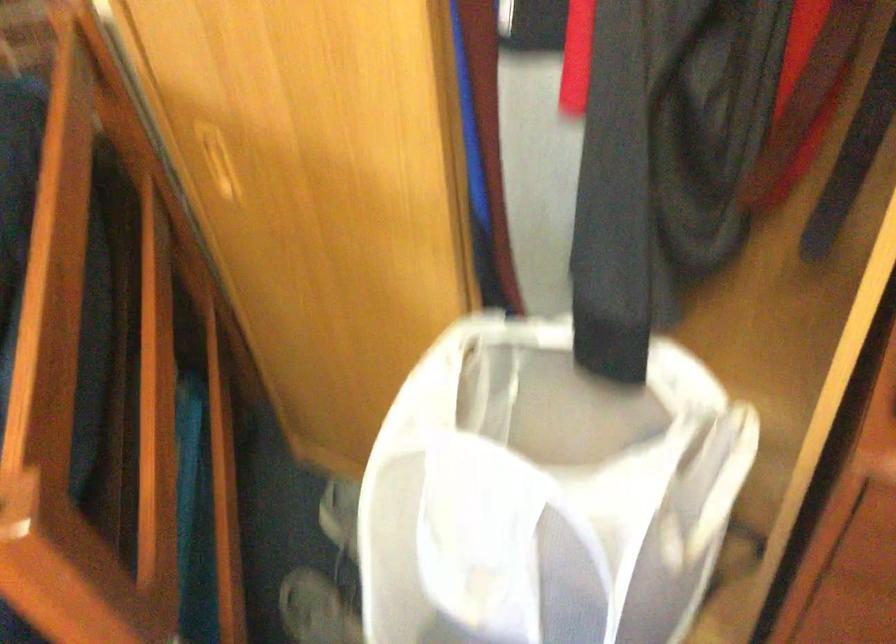
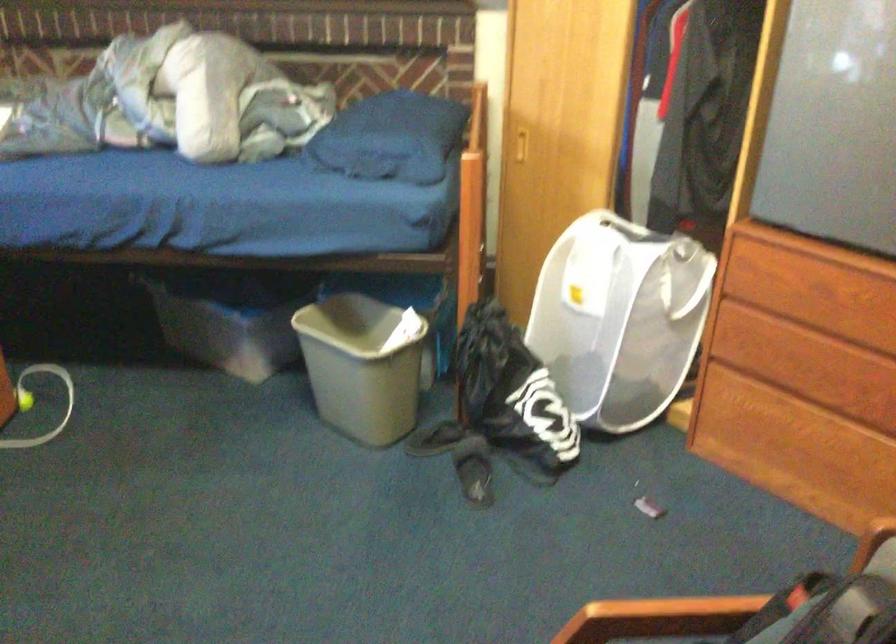
Question: Which direction would the cameraman need to move to produce the second image? Reply with the corresponding letter.

Choices:
 (A) Left
 (B) Right
 (C) Forward
 (D) Backward

Answer: (D)